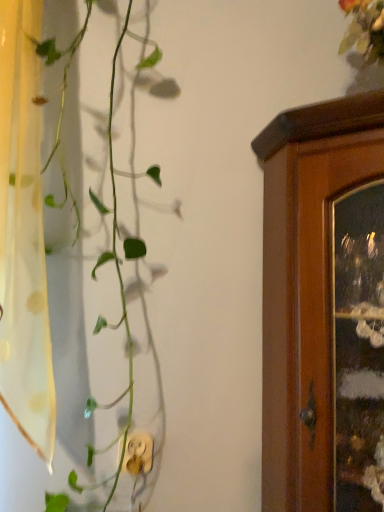
What do you see at coordinates (23, 234) in the screenshot?
I see `translucent yellow curtain at left` at bounding box center [23, 234].

What is the approximate width of translucent yellow curtain at left?

8.39 inches.

Identify the location of translucent yellow curtain at left. This screenshot has height=512, width=384. (23, 234).

Where is `translucent yellow curtain at left`? This screenshot has height=512, width=384. translucent yellow curtain at left is located at coordinates (23, 234).